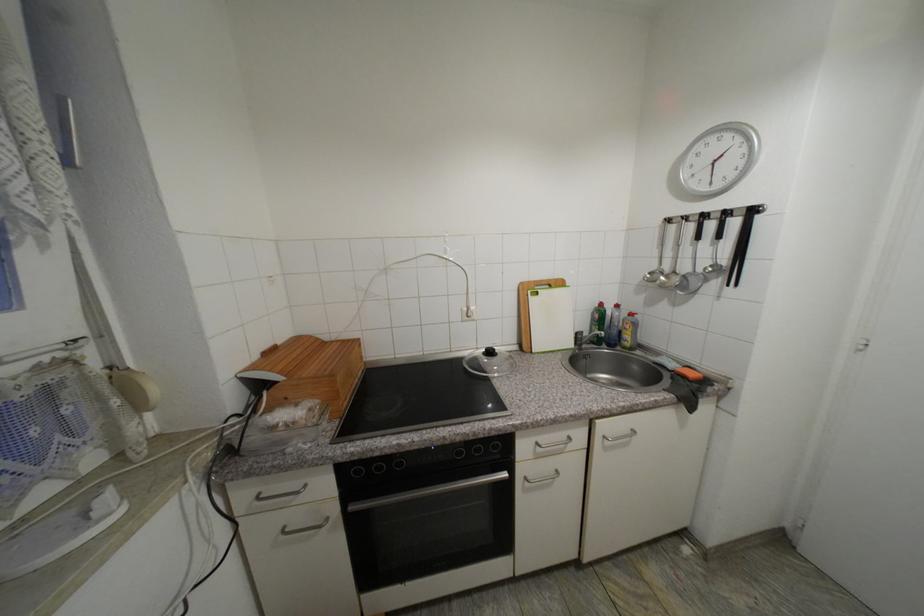
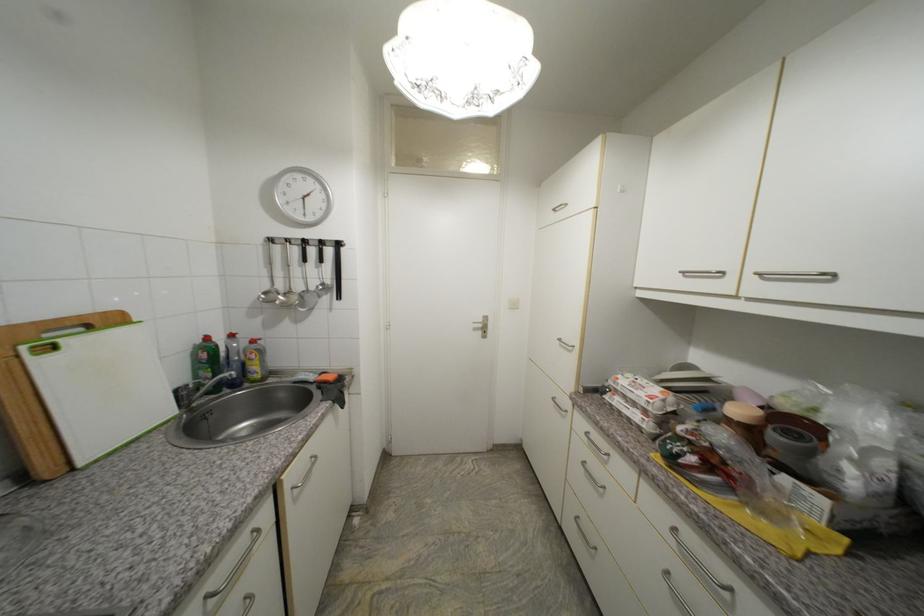
The point at (x=535, y=284) is marked in the first image. Where is the corresponding point in the second image?

(19, 328)